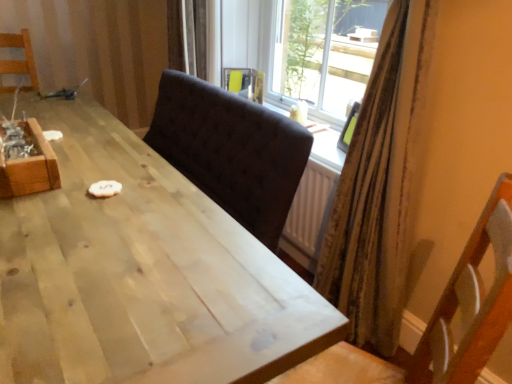
Question: Which direction should I rotate to look at dark fabric chair at center, the first chair viewed from the front, — up or down?

Choices:
 (A) up
 (B) down

Answer: (B)

Question: From a real-world perspective, is wooden crate at left physically below wooden chair at left, arranged as the second chair when viewed from the right?

Choices:
 (A) yes
 (B) no

Answer: (A)

Question: Is wooden chair at left, the 1th chair in the back-to-front sequence, at the back of wooden crate at left?

Choices:
 (A) no
 (B) yes

Answer: (A)

Question: Does wooden crate at left have a lesser width compared to wooden chair at left, positioned as the 1th chair in left-to-right order?

Choices:
 (A) no
 (B) yes

Answer: (B)

Question: Does wooden crate at left have a larger size compared to wooden chair at left, the second chair from the bottom?

Choices:
 (A) yes
 (B) no

Answer: (B)

Question: Is wooden crate at left positioned far away from wooden chair at left, which ranks as the 1th chair in top-to-bottom order?

Choices:
 (A) no
 (B) yes

Answer: (B)

Question: Is wooden crate at left outside wooden chair at left, which ranks as the 1th chair in top-to-bottom order?

Choices:
 (A) no
 (B) yes

Answer: (B)

Question: Is dark fabric chair at center, the 2th chair when ordered from left to right, positioned before wooden chair at left, marked as the 2th chair in a front-to-back arrangement?

Choices:
 (A) yes
 (B) no

Answer: (A)

Question: Is dark fabric chair at center, placed as the 2th chair when sorted from back to front, facing away from wooden chair at left, positioned as the 1th chair in left-to-right order?

Choices:
 (A) no
 (B) yes

Answer: (A)

Question: Is dark fabric chair at center, arranged as the 1th chair when viewed from the right, shorter than wooden chair at left, the 1th chair in the back-to-front sequence?

Choices:
 (A) no
 (B) yes

Answer: (A)

Question: Does dark fabric chair at center, placed as the first chair when sorted from bottom to top, come behind wooden chair at left, marked as the 2th chair in a front-to-back arrangement?

Choices:
 (A) yes
 (B) no

Answer: (B)

Question: Is dark fabric chair at center, arranged as the 1th chair when viewed from the right, thinner than wooden chair at left, positioned as the 1th chair in left-to-right order?

Choices:
 (A) no
 (B) yes

Answer: (A)

Question: From a real-world perspective, is dark fabric chair at center, placed as the 2th chair when sorted from back to front, beneath wooden chair at left, the second chair from the bottom?

Choices:
 (A) no
 (B) yes

Answer: (B)

Question: Can you confirm if wooden crate at left is smaller than light wood table at center?

Choices:
 (A) yes
 (B) no

Answer: (A)